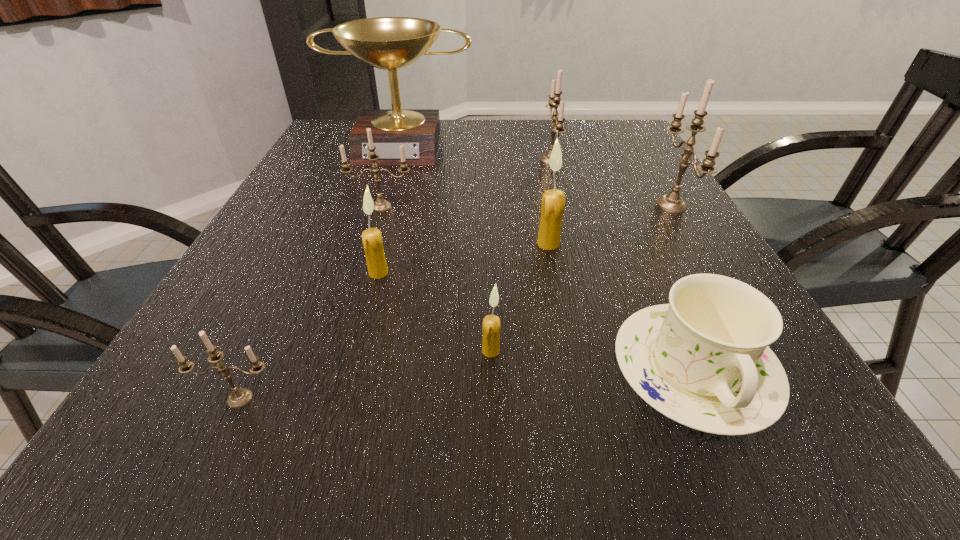
Where is `empty location between the smallest metallic candle and the chinaware`? The image size is (960, 540). empty location between the smallest metallic candle and the chinaware is located at coordinates [x=467, y=384].

Where is `free spot between the second cream candle from right to left and the biggest cream candle`? free spot between the second cream candle from right to left and the biggest cream candle is located at coordinates (519, 297).

This screenshot has width=960, height=540. In order to click on blank region between the rightmost candle and the third metallic candle from left to right in this screenshot , I will do `click(611, 183)`.

Locate an element on the screen. The width and height of the screenshot is (960, 540). free space between the biggest cream candle and the nearest candle is located at coordinates (395, 321).

At what (x,y) coordinates should I click in order to perform the action: click on free space between the fourth candle from right to left and the farthest metallic candle. Please return your answer as a coordinate pair (x, y). Looking at the image, I should click on (520, 255).

Identify the location of blank region between the chinaware and the award. This screenshot has height=540, width=960. (547, 257).

You are a GUI agent. You are given a task and a screenshot of the screen. Output one action in this format:
    pyautogui.click(x=<x>, y=<y>)
    Task: Click on the object that is the fourth closest one to the fourth nearest object
    The image size is (960, 540).
    Given the screenshot: What is the action you would take?
    pyautogui.click(x=553, y=201)

Locate an element on the screen. This screenshot has height=540, width=960. object that is the closest to the second nearest candle is located at coordinates (703, 360).

Select which candle is the sixth closest to the fifth nearest object. Please provide its 2D coordinates. Your answer should be formatted as a tuple, i.e. [(x, y)], where the tuple contains the x and y coordinates of a point satisfying the conditions above.

[(239, 397)]

Locate which candle is the fourth closest to the smallest metallic candle. Please provide its 2D coordinates. Your answer should be formatted as a tuple, i.e. [(x, y)], where the tuple contains the x and y coordinates of a point satisfying the conditions above.

[(553, 201)]